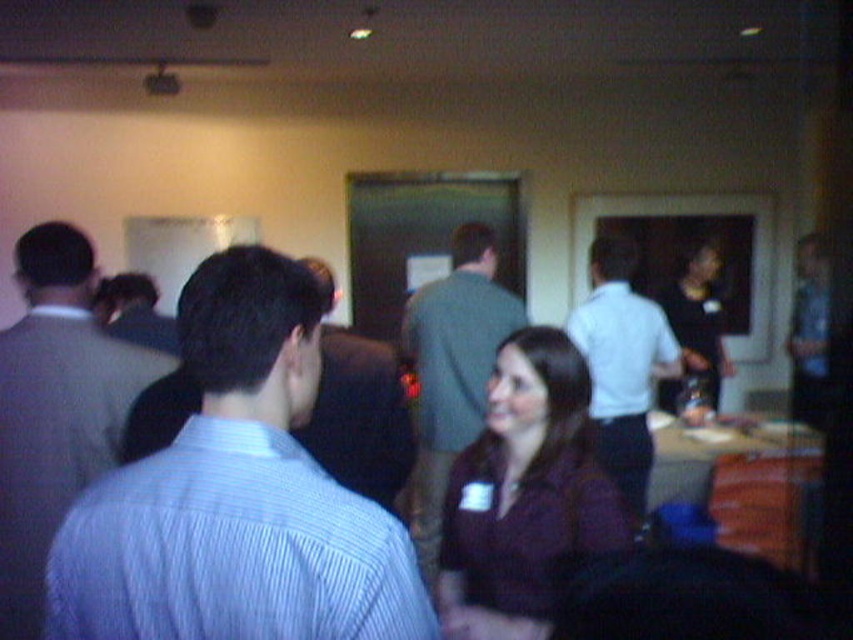
You are a photographer trying to capture a group photo of the maroon fabric shirt at center and the matte black shirt at center. The camera you are using has a minimum focusing distance of 2 meters. Will you be able to take a clear photo of both shirts at the same time?

The maroon fabric shirt at center is 2.89 meters from matte black shirt at center. Since the minimum focusing distance of the camera is 2 meters, the distance between them is sufficient for the camera to focus on both shirts simultaneously, so yes, you can take a clear photo of both shirts at the same time.

You are standing in the room and want to greet the person wearing the striped cotton shirt at left. Based on their position, which direction should you move to approach them?

The striped cotton shirt at left is located at point (55, 408), so you should move to the left to approach them.

You are standing at the entrance of the room and want to greet both the person wearing the maroon fabric shirt at center and the person wearing the matte black shirt at center. Which one should you approach first based on their positions?

You should approach the maroon fabric shirt at center first because it is located below the matte black shirt at center, meaning it is closer to your position at the entrance.